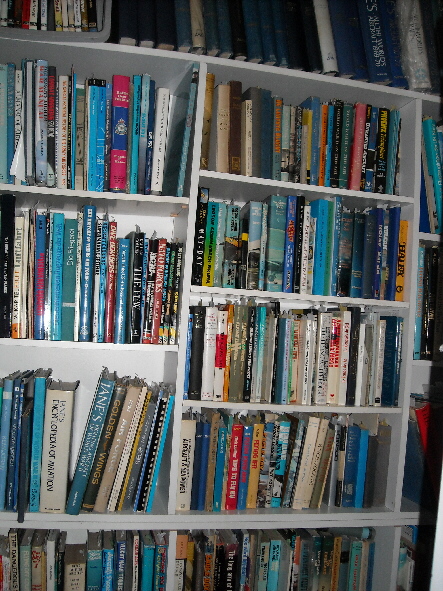
Where is `yellow book`? yellow book is located at coordinates (401, 272).